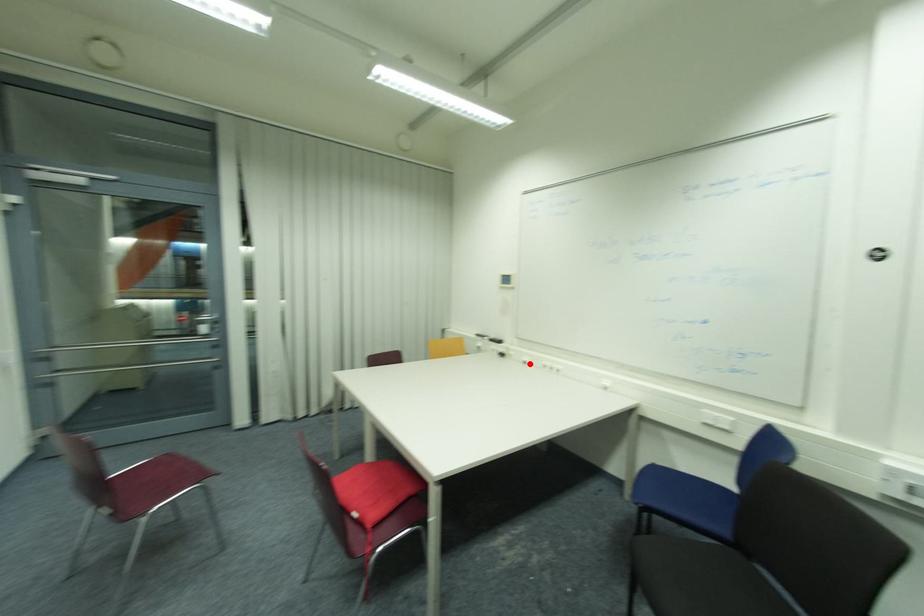
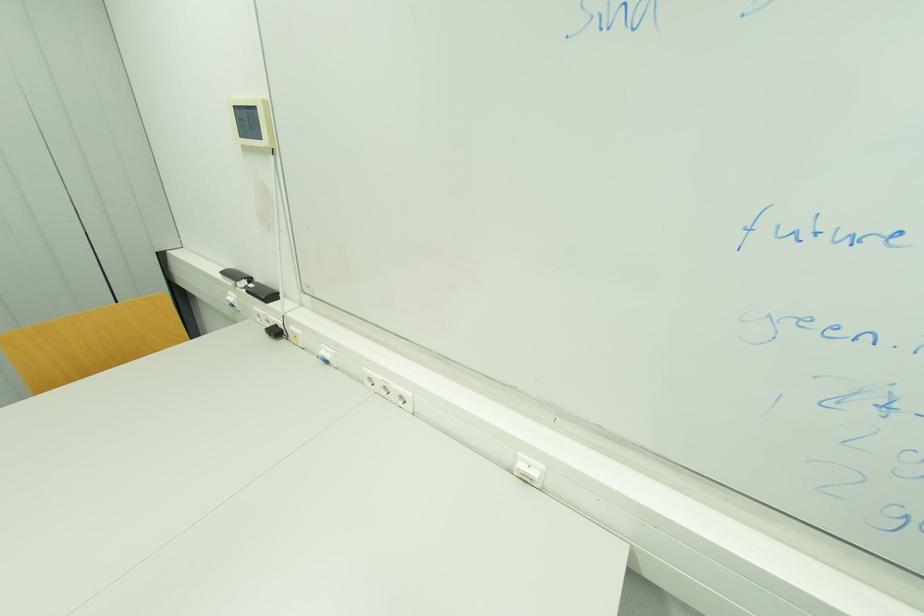
Find the pixel in the second image that matches the highlighted location in the first image.

(330, 362)